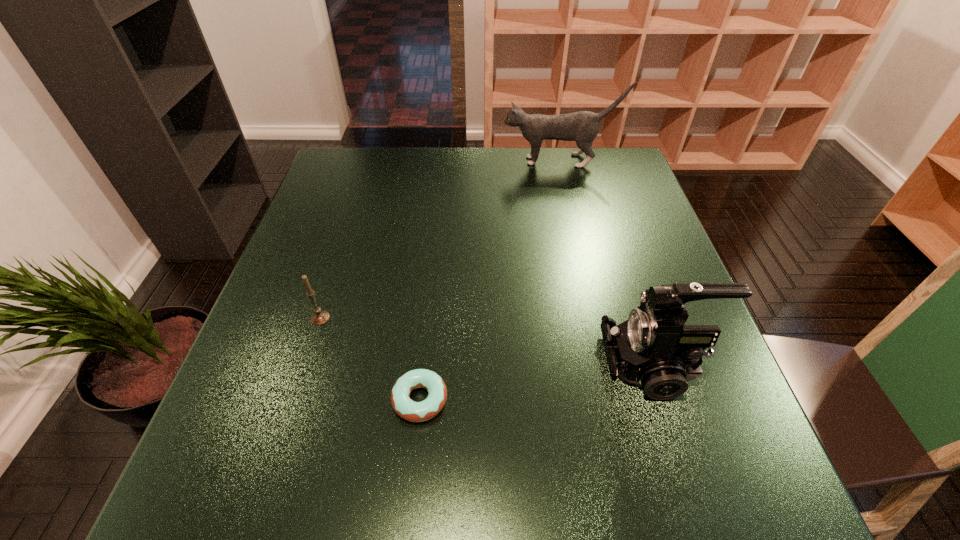
The height and width of the screenshot is (540, 960). In order to click on free space located 0.080m on the lens mount of the camcorder in this screenshot , I will do `click(564, 363)`.

Image resolution: width=960 pixels, height=540 pixels. I want to click on vacant space situated 0.080m on the lens mount of the camcorder, so click(x=564, y=363).

At what (x,y) coordinates should I click in order to perform the action: click on vacant point located on the front of the leftmost object. Please return your answer as a coordinate pair (x, y). Image resolution: width=960 pixels, height=540 pixels. Looking at the image, I should click on (288, 421).

Locate an element on the screen. Image resolution: width=960 pixels, height=540 pixels. free spot located 0.240m on the left of the doughnut is located at coordinates (260, 400).

Find the location of a particular element. Image resolution: width=960 pixels, height=540 pixels. object at the far edge is located at coordinates (583, 126).

Identify the location of object that is at the left edge. The height and width of the screenshot is (540, 960). (320, 317).

Locate an element on the screen. This screenshot has width=960, height=540. cat located at the right edge is located at coordinates (583, 126).

At what (x,y) coordinates should I click in order to perform the action: click on camcorder that is at the right edge. Please return your answer as a coordinate pair (x, y). Looking at the image, I should click on (653, 349).

At what (x,y) coordinates should I click in order to perform the action: click on object at the far right corner. Please return your answer as a coordinate pair (x, y). The width and height of the screenshot is (960, 540). Looking at the image, I should click on (583, 126).

This screenshot has height=540, width=960. Find the location of `free space at the far edge of the desktop`. free space at the far edge of the desktop is located at coordinates (491, 188).